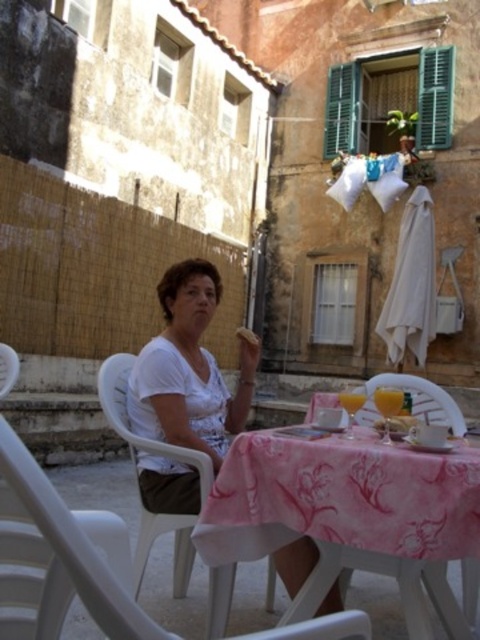
Question: Does translucent glass juice at table center appear on the right side of white matte bread at center?

Choices:
 (A) yes
 (B) no

Answer: (A)

Question: Which point is farther to the camera?

Choices:
 (A) smooth yellow bread at table center
 (B) white matte shirt at center

Answer: (B)

Question: Is white matte shirt at center below smooth yellow bread at table center?

Choices:
 (A) no
 (B) yes

Answer: (A)

Question: Which of these objects is positioned closest to the translucent glass juice at table center?

Choices:
 (A) white matte bread at center
 (B) white matte shirt at center

Answer: (B)

Question: Does smooth yellow bread at table center appear on the left side of white matte bread at center?

Choices:
 (A) yes
 (B) no

Answer: (B)

Question: Estimate the real-world distances between objects in this image. Which object is closer to the translucent glass juice at table center?

Choices:
 (A) smooth yellow bread at table center
 (B) white matte bread at center

Answer: (A)